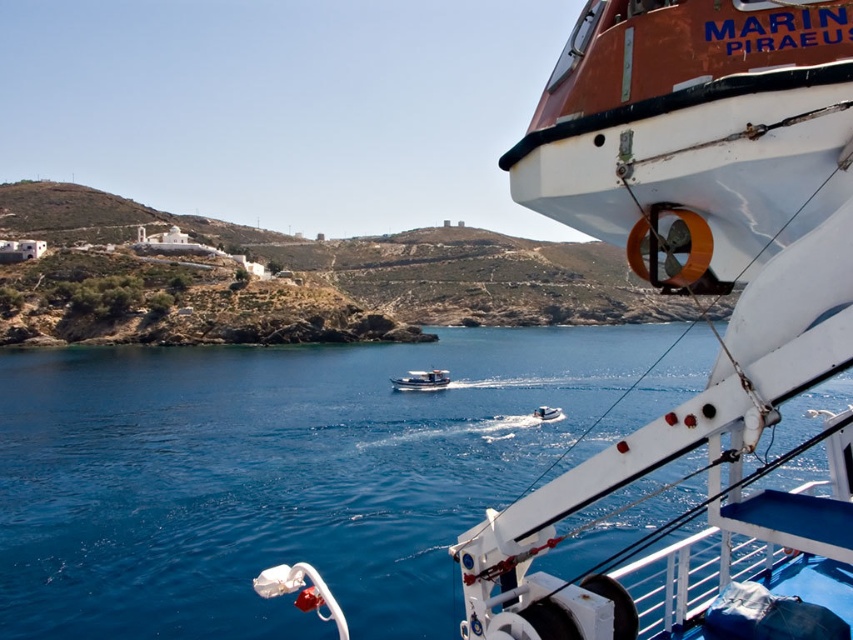
You are on a boat and looking out at the scene. You see the blue water at center and the white glossy motorboat at center. Which one is positioned to the left?

The blue water at center is positioned to the left of the white glossy motorboat at center.